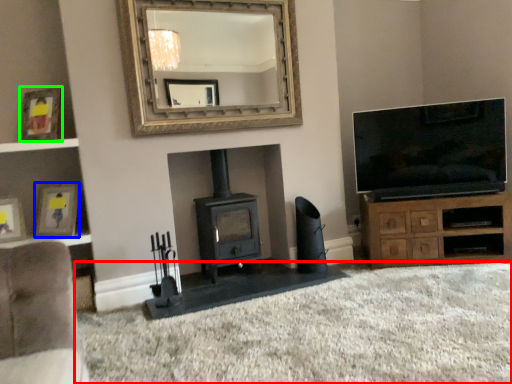
Question: Considering the real-world distances, which object is farthest from plain (highlighted by a red box)? picture frame (highlighted by a blue box) or picture frame (highlighted by a green box)?

Choices:
 (A) picture frame
 (B) picture frame

Answer: (B)